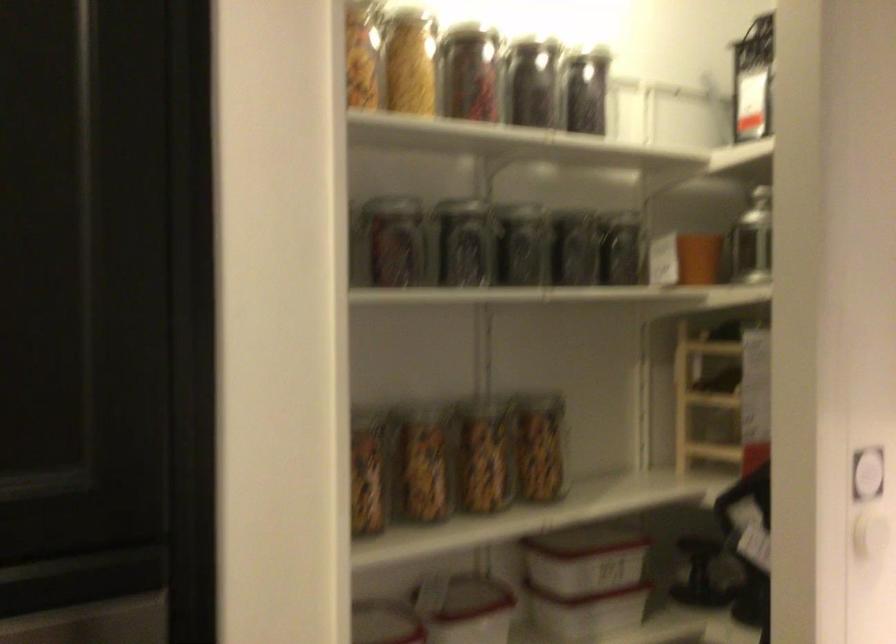
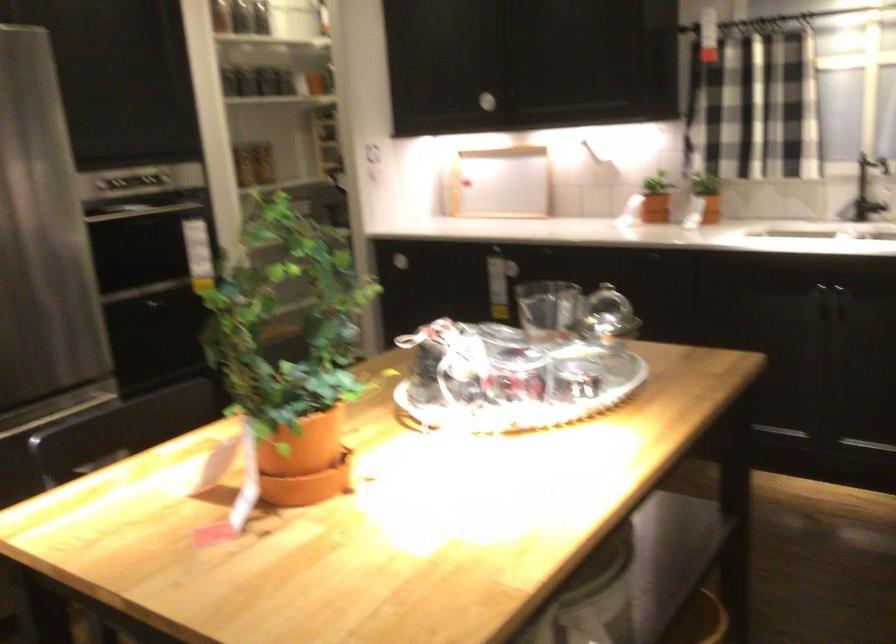
Question: Which direction would the cameraman need to move to produce the second image? Reply with the corresponding letter.

Choices:
 (A) Left
 (B) Right
 (C) Forward
 (D) Backward

Answer: (D)